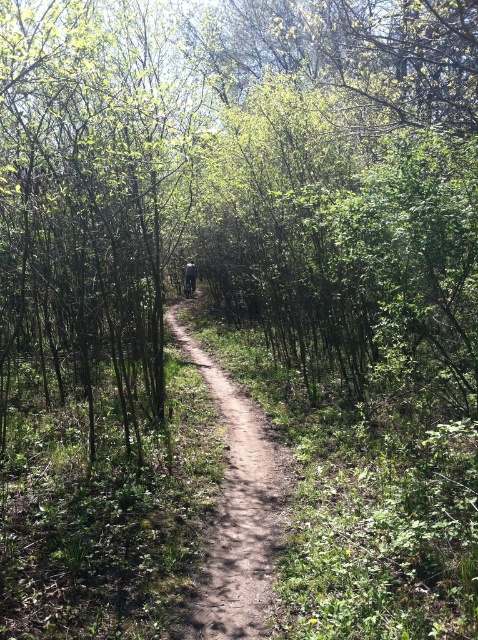
You are a hiker carrying a dark gray fabric backpack at center and want to follow the dirt track at center to reach a cabin located further along the path. Which direction should you move relative to your backpack to stay on the path?

The dirt track at center is positioned on the right side of dark gray fabric backpack at center, so to stay on the path, you should move to the right relative to your backpack.

You are a hiker who wants to place your dark gray fabric backpack at center on the dirt track at center. Can you fit it entirely on the track?

The dirt track at center is shorter than the dark gray fabric backpack at center, so the backpack will not fit entirely on the track.